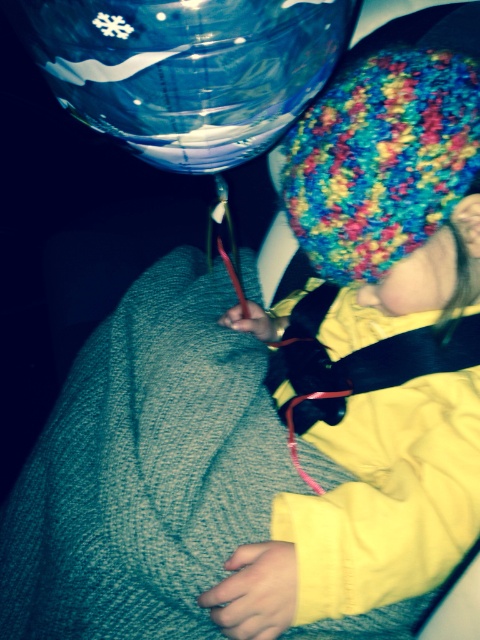
Question: Is transparent plastic balloon at upper center smaller than multicolored knitted hat at upper right?

Choices:
 (A) no
 (B) yes

Answer: (B)

Question: Is transparent plastic balloon at upper center below multicolored knitted hat at upper right?

Choices:
 (A) no
 (B) yes

Answer: (A)

Question: Can you confirm if transparent plastic balloon at upper center is smaller than multicolored knitted hat at upper right?

Choices:
 (A) yes
 (B) no

Answer: (A)

Question: Which object appears closest to the camera in this image?

Choices:
 (A) transparent plastic balloon at upper center
 (B) multicolored knitted hat at upper right
 (C) knitted multicolor hat at center

Answer: (A)

Question: Which point is closer to the camera?

Choices:
 (A) (365, 241)
 (B) (332, 237)

Answer: (A)

Question: Which is farther from the multicolored knitted hat at upper right?

Choices:
 (A) transparent plastic balloon at upper center
 (B) knitted multicolor hat at center

Answer: (A)